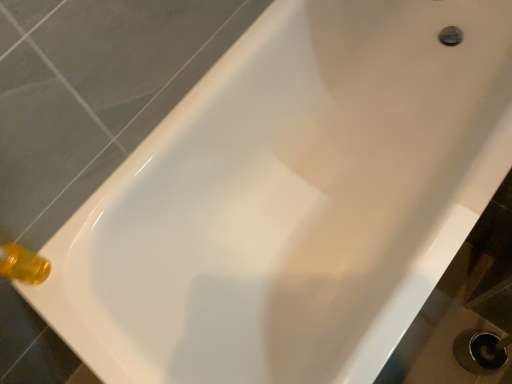
Locate an element on the screen. The height and width of the screenshot is (384, 512). translucent yellow liquid at lower left is located at coordinates (23, 264).

This screenshot has width=512, height=384. Describe the element at coordinates (23, 264) in the screenshot. I see `translucent yellow liquid at lower left` at that location.

Where is `translucent yellow liquid at lower left`? Image resolution: width=512 pixels, height=384 pixels. translucent yellow liquid at lower left is located at coordinates (23, 264).